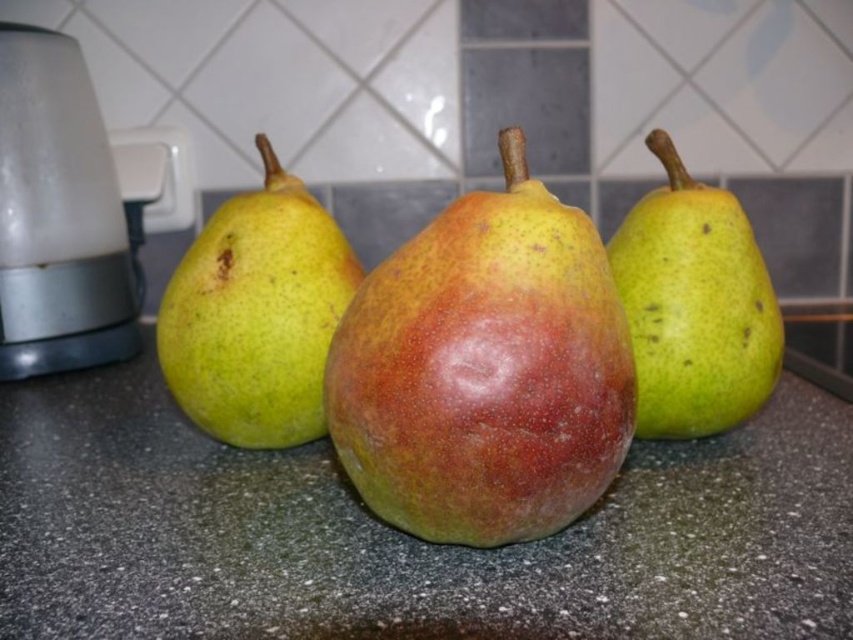
Who is shorter, white plastic blender at left or green matte pear at right?

green matte pear at right

Between point (122, 230) and point (741, 218), which one is positioned behind?

Point (122, 230)

Which is behind, point (49, 176) or point (697, 289)?

Point (49, 176)

What are the coordinates of `white plastic blender at left` in the screenshot? It's located at (61, 216).

Between speckled granite countertop at center and speckled yellow-green pear at center, which one has less height?

speckled granite countertop at center

Who is positioned more to the left, speckled granite countertop at center or speckled yellow-green pear at center?

Positioned to the left is speckled granite countertop at center.

You are a GUI agent. You are given a task and a screenshot of the screen. Output one action in this format:
    pyautogui.click(x=<x>, y=<y>)
    Task: Click on the speckled granite countertop at center
    This screenshot has width=853, height=640.
    Given the screenshot: What is the action you would take?
    pyautogui.click(x=404, y=532)

You are a GUI agent. You are given a task and a screenshot of the screen. Output one action in this format:
    pyautogui.click(x=<x>, y=<y>)
    Task: Click on the speckled granite countertop at center
    The height and width of the screenshot is (640, 853).
    Given the screenshot: What is the action you would take?
    pyautogui.click(x=404, y=532)

Is green matte pear at center thinner than green matte pear at right?

No.

Who is positioned more to the right, green matte pear at center or green matte pear at right?

Positioned to the right is green matte pear at right.

Is point (306, 228) in front of point (718, 349)?

No, it is not.

Find the location of a particular element. green matte pear at center is located at coordinates (256, 314).